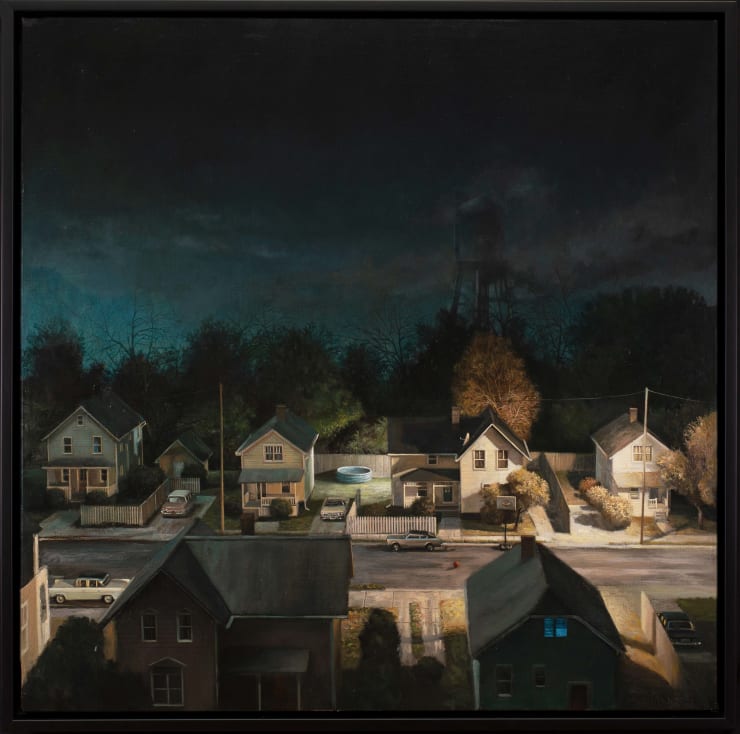
This screenshot has height=734, width=740. I want to click on painting, so click(539, 600).